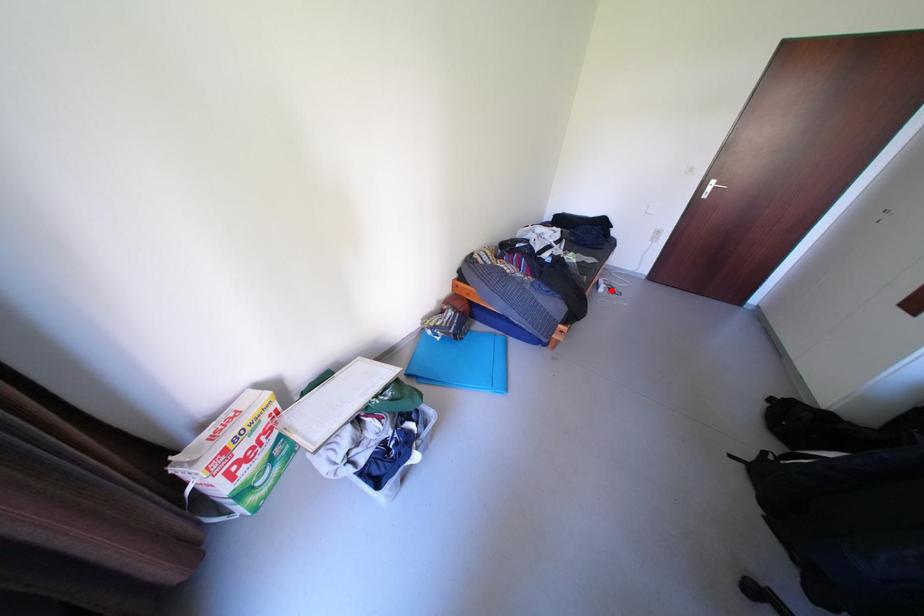
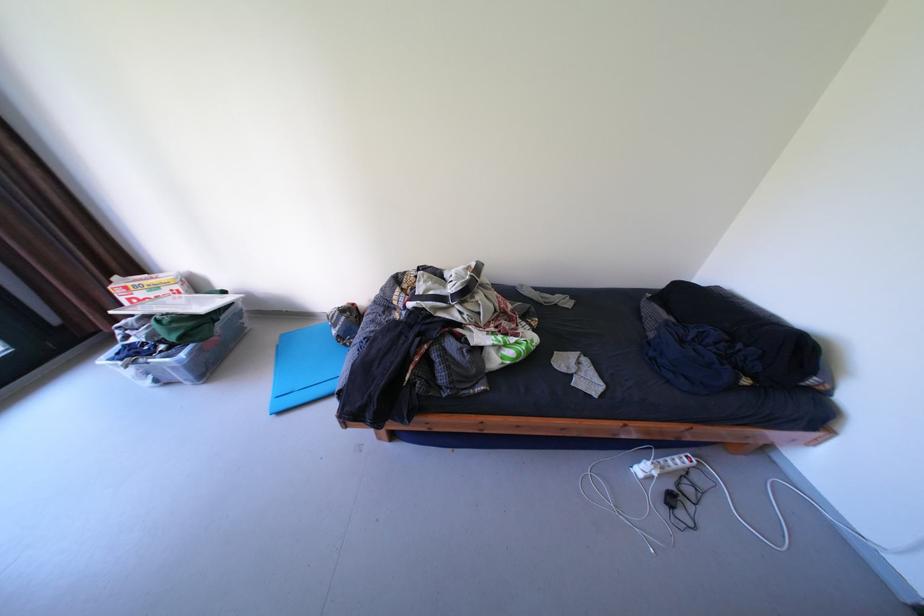
Question: I am providing you with two images of the same scene from different viewpoints. In image1, a red point is highlighted. Considering the same 3D point in image2, which of the following is correct?

Choices:
 (A) It is closer
 (B) It is farther

Answer: (A)